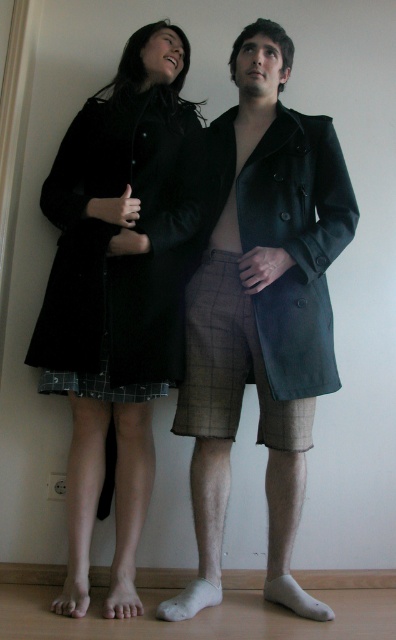
Is point (161, 301) positioned before point (291, 385)?

No, it is not.

Which is more to the left, matte black dress at center or matte black coat at center?

matte black dress at center

This screenshot has height=640, width=396. I want to click on matte black dress at center, so click(x=118, y=232).

In order to click on matte black dress at center in this screenshot , I will do `click(118, 232)`.

Can you confirm if matte black dress at center is wider than plaid fabric kilt at lower center?

Yes, matte black dress at center is wider than plaid fabric kilt at lower center.

Consider the image. Which is more to the right, matte black dress at center or plaid fabric kilt at lower center?

matte black dress at center

Who is more distant from viewer, [93,339] or [66,372]?

The point [66,372] is more distant.

Locate an element on the screen. matte black dress at center is located at coordinates (118, 232).

Who is positioned more to the right, matte black coat at center or brown checkered kilt at center?

matte black coat at center is more to the right.

Which of these two, matte black coat at center or brown checkered kilt at center, stands shorter?

brown checkered kilt at center

Does point (333, 236) lie in front of point (253, 355)?

Yes.

You are a GUI agent. You are given a task and a screenshot of the screen. Output one action in this format:
    pyautogui.click(x=<x>, y=<y>)
    Task: Click on the matte black coat at center
    The image size is (396, 640).
    Given the screenshot: What is the action you would take?
    pyautogui.click(x=297, y=244)